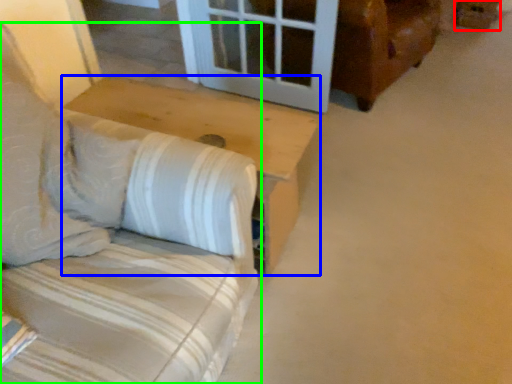
Question: Which is nearer to the cardboard box (highlighted by a red box)? table (highlighted by a blue box) or furniture (highlighted by a green box).

Choices:
 (A) table
 (B) furniture

Answer: (A)